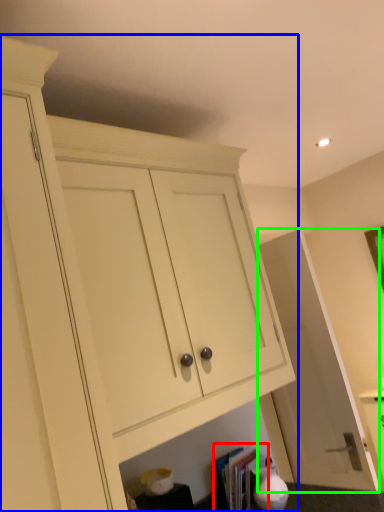
Question: Which object is positioned closest to book (highlighted by a red box)? Select from cabinetry (highlighted by a blue box) and door (highlighted by a green box).

Choices:
 (A) cabinetry
 (B) door

Answer: (B)